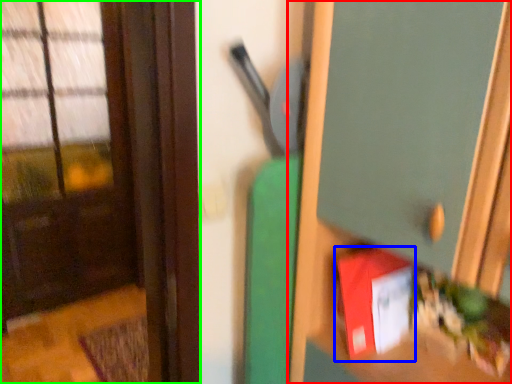
Question: Estimate the real-world distances between objects in this image. Which object is farther from dresser (highlighted by a red box), book (highlighted by a blue box) or door (highlighted by a green box)?

Choices:
 (A) book
 (B) door

Answer: (B)